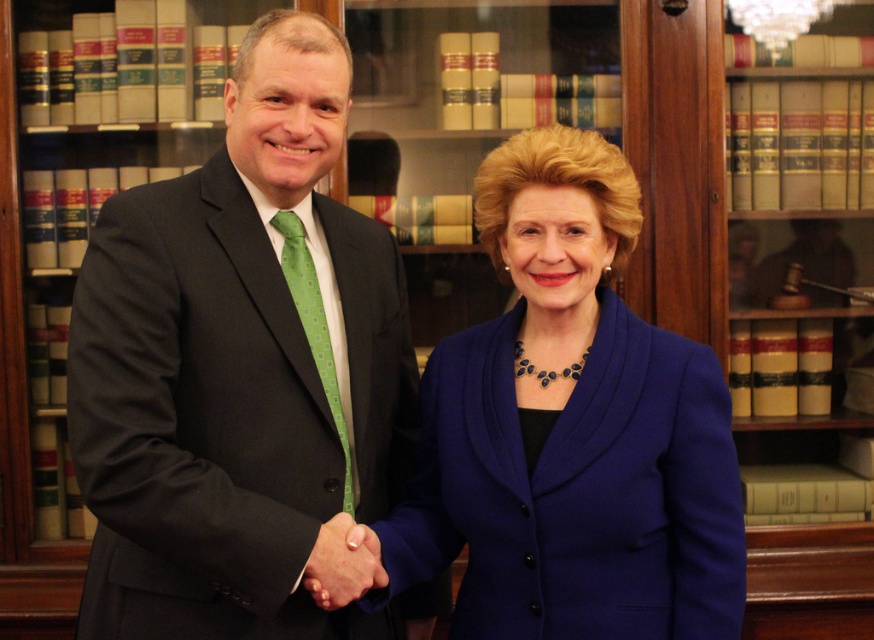
Is blue fabric jacket at center closer to the viewer compared to green dotted tie at center?

Yes, it is.

What do you see at coordinates (571, 429) in the screenshot? I see `blue fabric jacket at center` at bounding box center [571, 429].

The height and width of the screenshot is (640, 874). Find the location of `blue fabric jacket at center`. blue fabric jacket at center is located at coordinates (571, 429).

Which of these two, black suit at left or smooth skin handshake at center, stands taller?

With more height is black suit at left.

Consider the image. Does black suit at left have a lesser width compared to smooth skin handshake at center?

No, black suit at left is not thinner than smooth skin handshake at center.

At what (x,y) coordinates should I click in order to perform the action: click on black suit at left. Please return your answer as a coordinate pair (x, y). This screenshot has height=640, width=874. Looking at the image, I should click on (241, 371).

This screenshot has width=874, height=640. What are the coordinates of `black suit at left` in the screenshot? It's located at (241, 371).

Is blue fabric jacket at center positioned in front of smooth skin handshake at center?

Yes, blue fabric jacket at center is in front of smooth skin handshake at center.

Is blue fabric jacket at center below smooth skin handshake at center?

No, blue fabric jacket at center is not below smooth skin handshake at center.

The width and height of the screenshot is (874, 640). Describe the element at coordinates (571, 429) in the screenshot. I see `blue fabric jacket at center` at that location.

Locate an element on the screen. The width and height of the screenshot is (874, 640). blue fabric jacket at center is located at coordinates (571, 429).